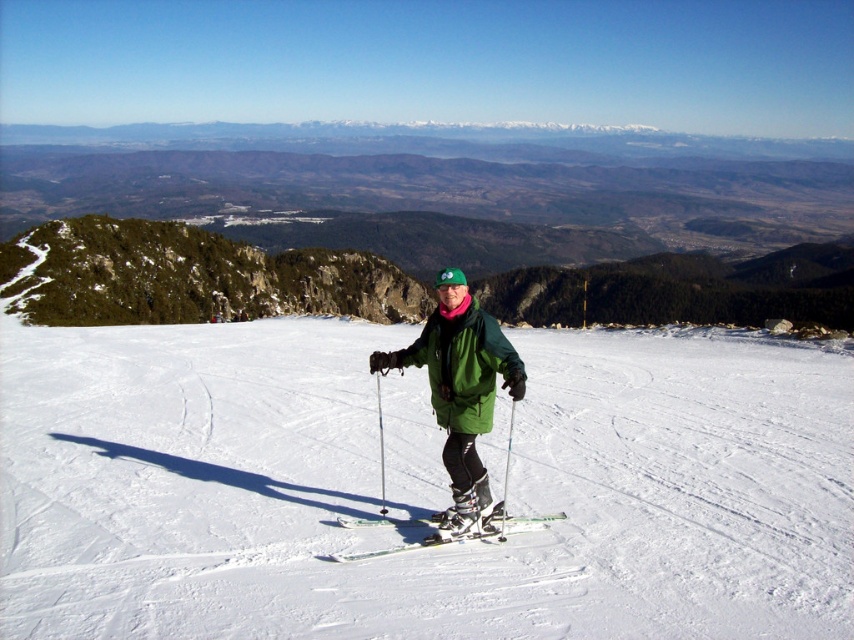
You are a drone operator tasked with capturing aerial footage of the scene. Your drone has a maximum flight range of 25 feet. If you want to ensure the drone can capture both the white smooth snow at center and the green matte jacket at center in the same shot without exceeding its range, is this possible?

The distance between the white smooth snow at center and the green matte jacket at center is 25.13 feet. Since the drone has a maximum flight range of 25 feet, it cannot capture both objects in the same shot without exceeding its range.

What are the coordinates of the green matte jacket at center in the image?

The green matte jacket at center is located at coordinates point (463, 365).